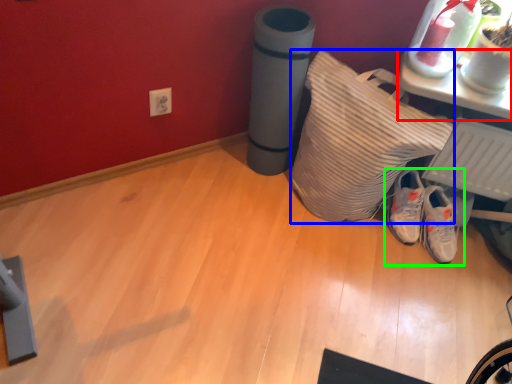
Question: Considering the real-world distances, which object is closest to furniture (highlighted by a red box)? pillow (highlighted by a blue box) or footwear (highlighted by a green box).

Choices:
 (A) pillow
 (B) footwear

Answer: (A)